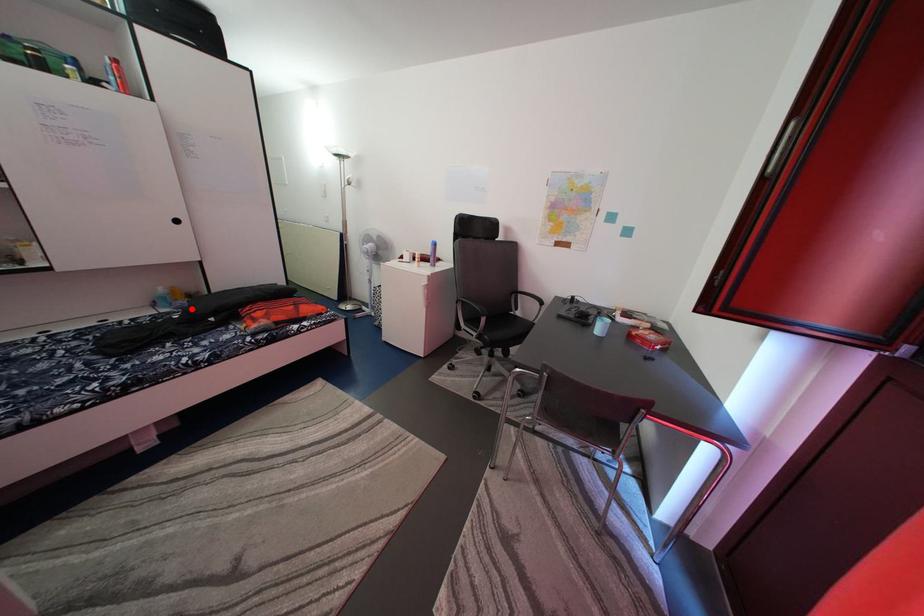
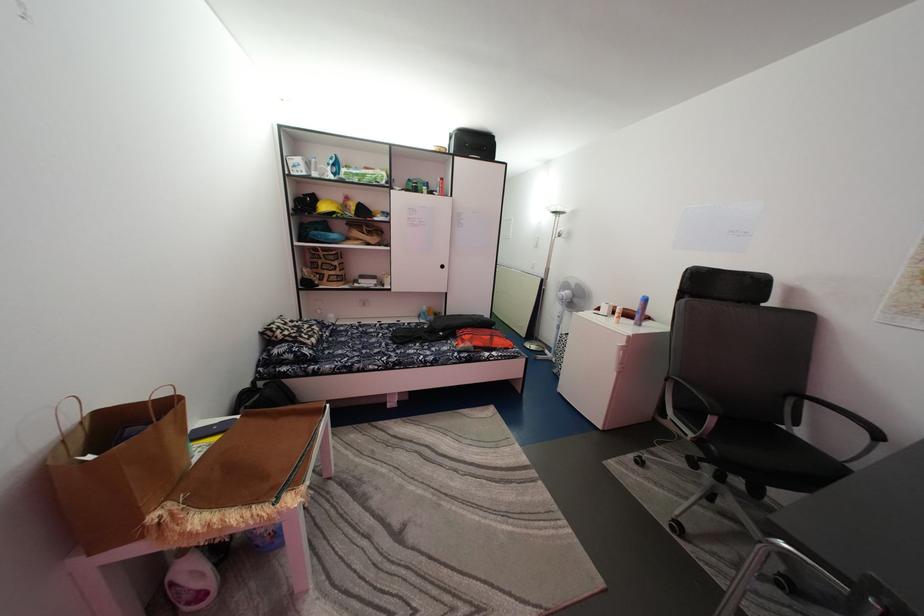
Where in the second image is the point corresponding to the highlighted location from the first image?

(440, 325)